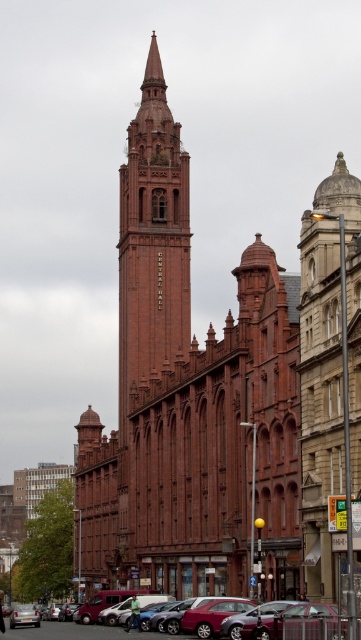
Question: Is brick tower at center wider than metallic silver car at lower left?

Choices:
 (A) yes
 (B) no

Answer: (B)

Question: Among these objects, which one is farthest from the camera?

Choices:
 (A) metallic silver car at lower center
 (B) red brick church at center
 (C) stone dome at center

Answer: (B)

Question: Is stone dome at center wider than metallic silver car at lower center?

Choices:
 (A) no
 (B) yes

Answer: (A)

Question: Among these points, which one is farthest from the camera?

Choices:
 (A) coord(158,372)
 (B) coord(184,353)
 (C) coord(14,620)

Answer: (B)

Question: Which object is positioned closest to the brick tower at center?

Choices:
 (A) stone dome at center
 (B) metallic silver car at lower center

Answer: (B)

Question: Does red brick church at center have a lesser width compared to metallic silver car at lower left?

Choices:
 (A) no
 (B) yes

Answer: (A)